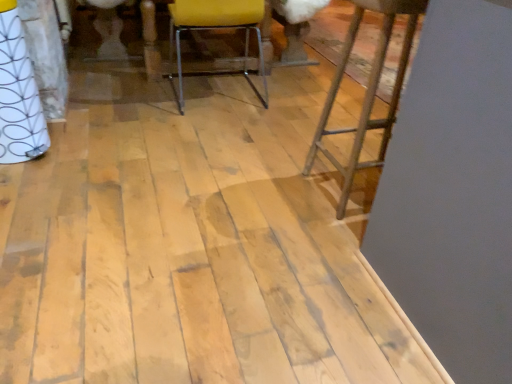
Locate an element on the screen. The image size is (512, 384). free space that is in between rustic wood stool at right and yellow fabric chair at center is located at coordinates (265, 136).